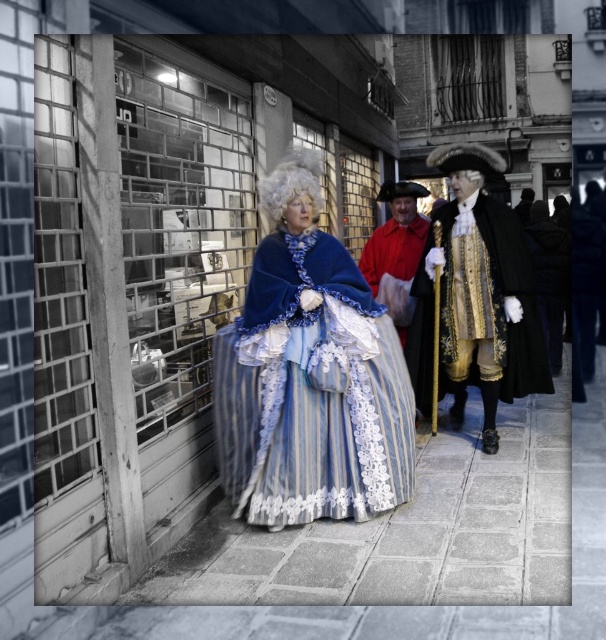
In the historical street scene, there is a woman wearing a velvet blue cape at center and another person wearing a gold brocade coat at right. From the perspective of someone standing in front of the woman, which piece of clothing is positioned to the left?

The velvet blue cape at center is positioned to the left of the gold brocade coat at right.

You are a costume designer observing the historical street scene. You need to determine the spatial arrangement of the velvet blue cape at center and the gold brocade coat at right. Which object is placed lower in the image?

The velvet blue cape at center is positioned under the gold brocade coat at right, so the velvet blue cape at center is lower in the image.